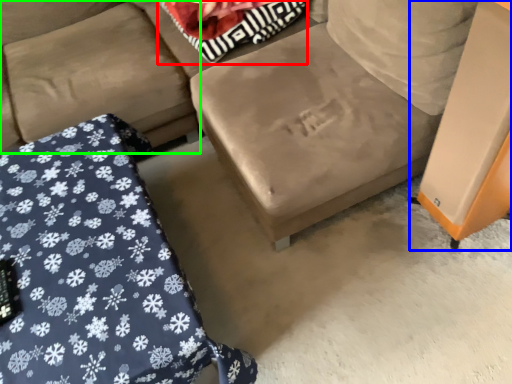
Question: Which object is positioned closest to pillow (highlighted by a red box)? Select from table (highlighted by a blue box) and couch (highlighted by a green box).

Choices:
 (A) table
 (B) couch

Answer: (B)